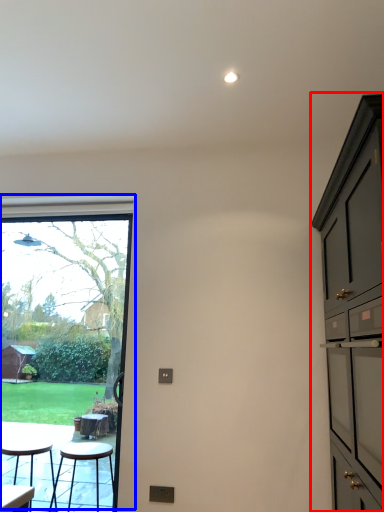
Question: Which object is closer to the camera taking this photo, cabinetry (highlighted by a red box) or window (highlighted by a blue box)?

Choices:
 (A) cabinetry
 (B) window

Answer: (A)